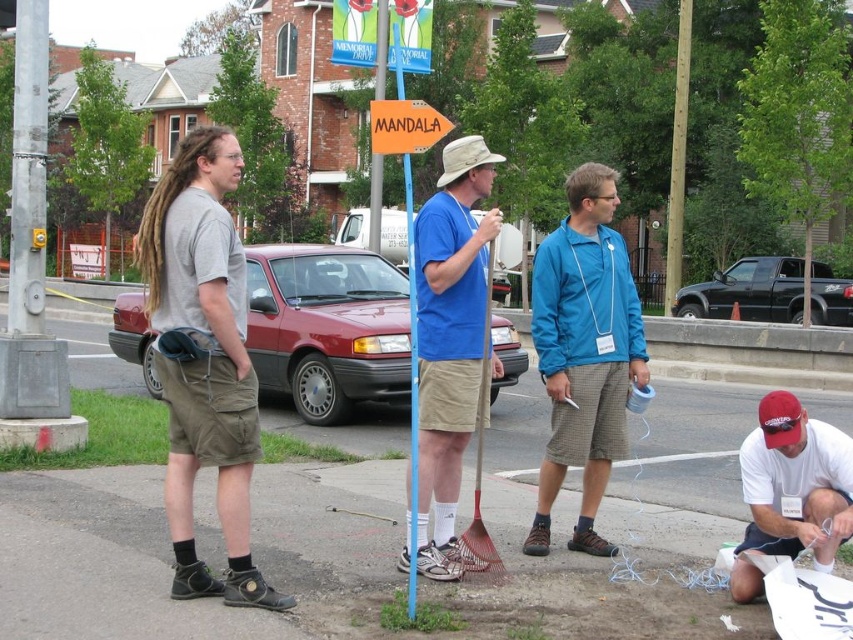
Which is above, gray cotton t-shirt at left or blue t-shirt at center?

Positioned higher is blue t-shirt at center.

Between gray cotton t-shirt at left and blue t-shirt at center, which one has more height?

gray cotton t-shirt at left

Between point (242, 298) and point (456, 564), which one is positioned in front?

Point (242, 298) is more forward.

What are the coordinates of `gray cotton t-shirt at left` in the screenshot? It's located at (204, 358).

Is gray cotton t-shirt at left thinner than orange plastic sign at center?

Yes, gray cotton t-shirt at left is thinner than orange plastic sign at center.

Is gray cotton t-shirt at left wider than orange plastic sign at center?

No, gray cotton t-shirt at left is not wider than orange plastic sign at center.

Between point (155, 243) and point (372, 116), which one is positioned in front?

Point (155, 243) is more forward.

The width and height of the screenshot is (853, 640). In order to click on gray cotton t-shirt at left in this screenshot , I will do `click(204, 358)`.

Does blue textured jacket at center appear over orange plastic signpost at center?

No, blue textured jacket at center is not above orange plastic signpost at center.

Locate an element on the screen. The height and width of the screenshot is (640, 853). blue textured jacket at center is located at coordinates (584, 352).

You are a GUI agent. You are given a task and a screenshot of the screen. Output one action in this format:
    pyautogui.click(x=<x>, y=<y>)
    Task: Click on the blue textured jacket at center
    This screenshot has height=640, width=853.
    Given the screenshot: What is the action you would take?
    pyautogui.click(x=584, y=352)